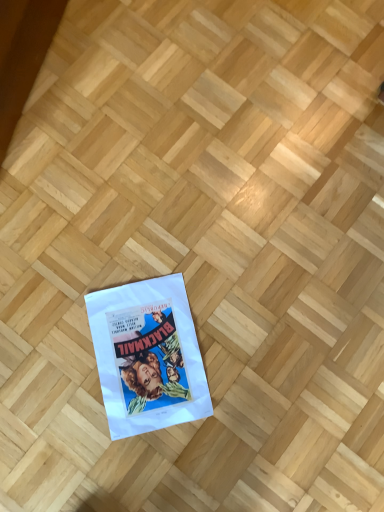
Image resolution: width=384 pixels, height=512 pixels. I want to click on free space in front of white paper at center, so (120, 458).